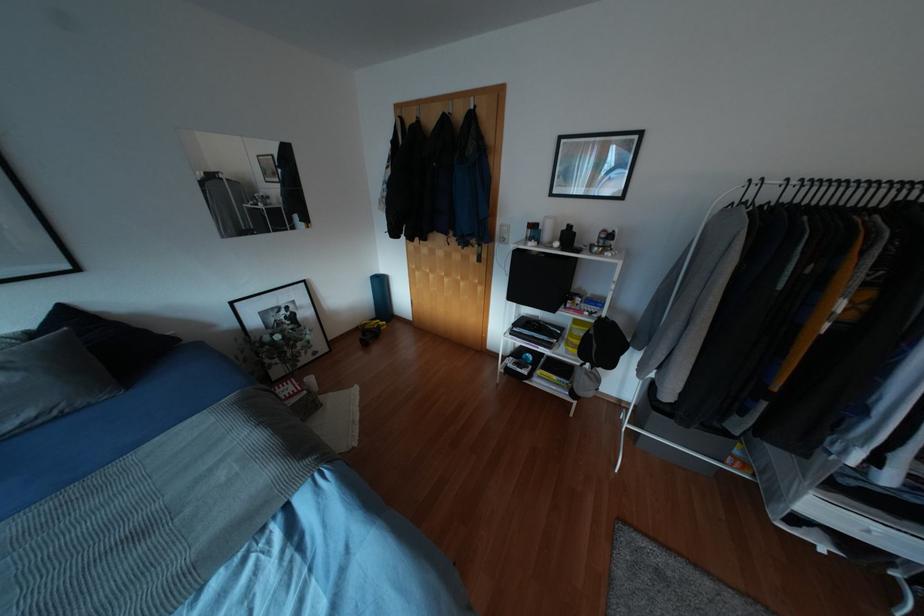
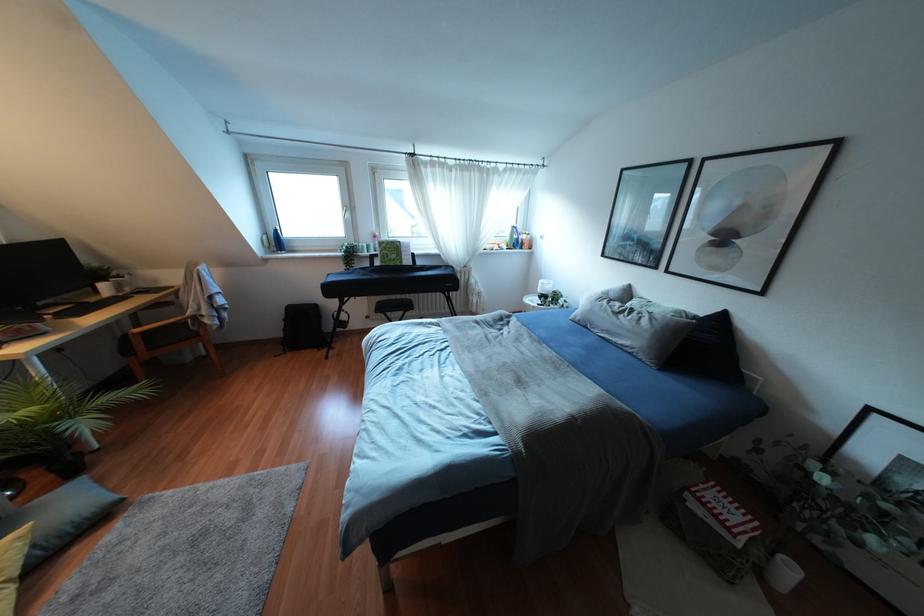
The point at (x=310, y=379) is marked in the first image. Where is the corresponding point in the second image?

(791, 570)